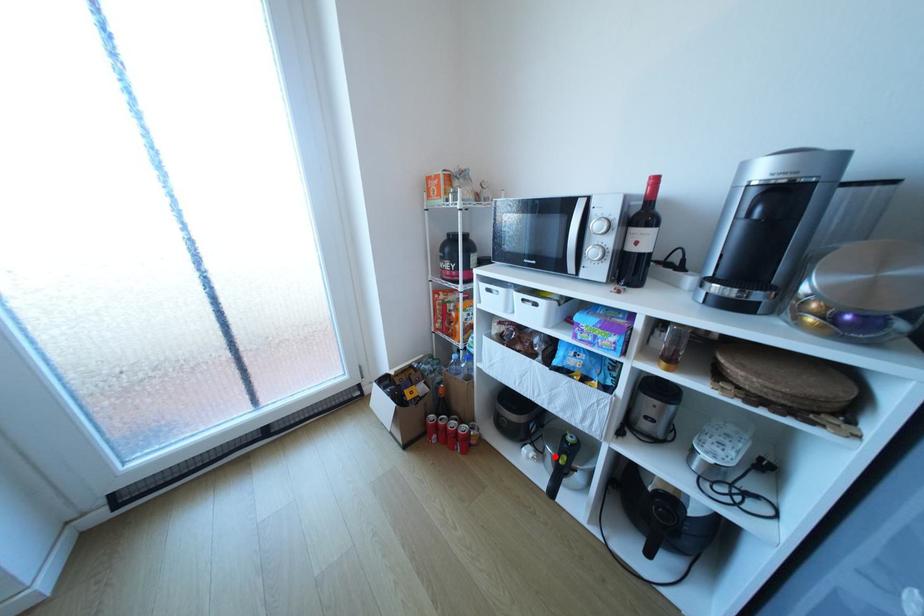
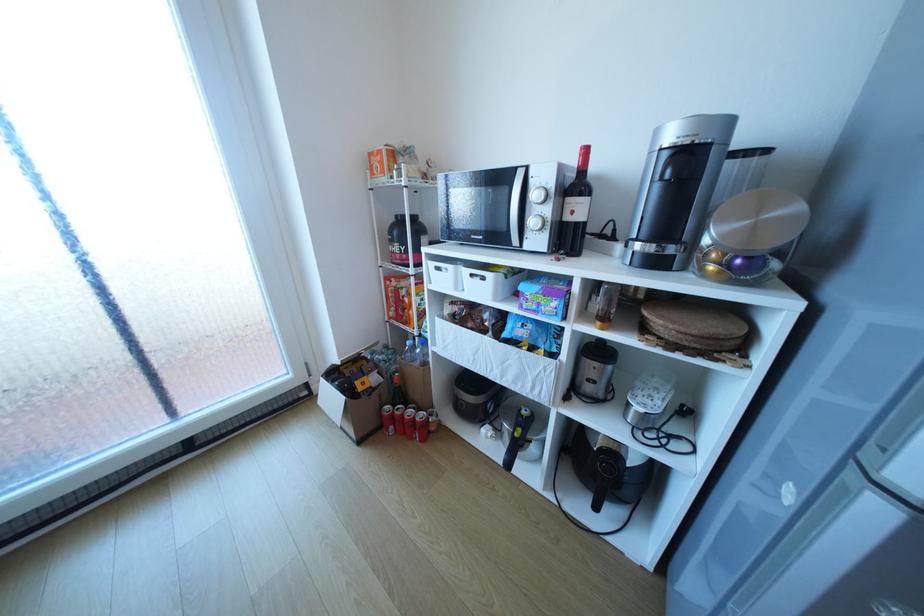
Find the pixel in the second image that matches the highlighted location in the first image.

(513, 434)